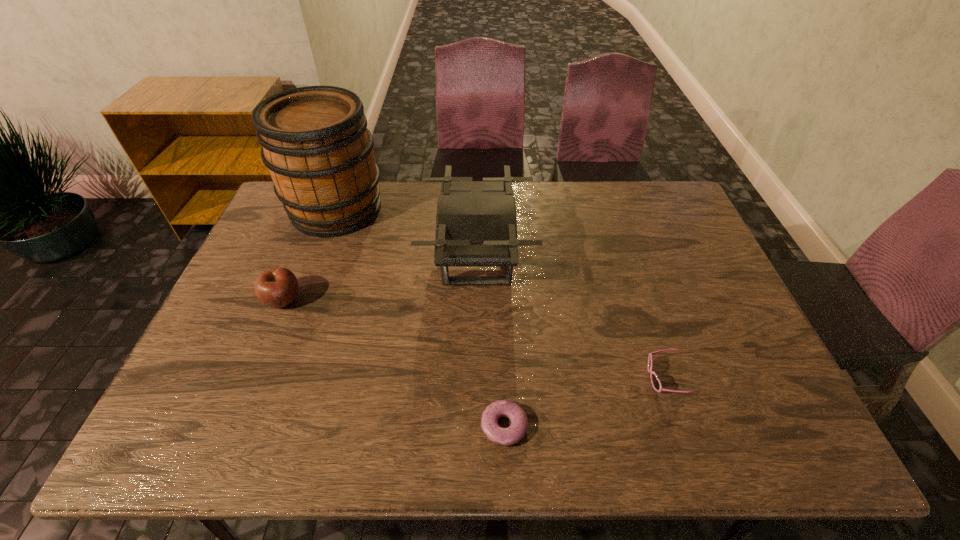
The width and height of the screenshot is (960, 540). What are the coordinates of `vacant point that satisfies the following two spatial constraints: 1. on the front side of the cider; 2. on the right side of the nearest object` in the screenshot? It's located at (256, 426).

Find the location of `free location that satisfies the following two spatial constraints: 1. with a camera mounted on the underside of the drone; 2. on the right side of the nearest object`. free location that satisfies the following two spatial constraints: 1. with a camera mounted on the underside of the drone; 2. on the right side of the nearest object is located at coordinates (476, 426).